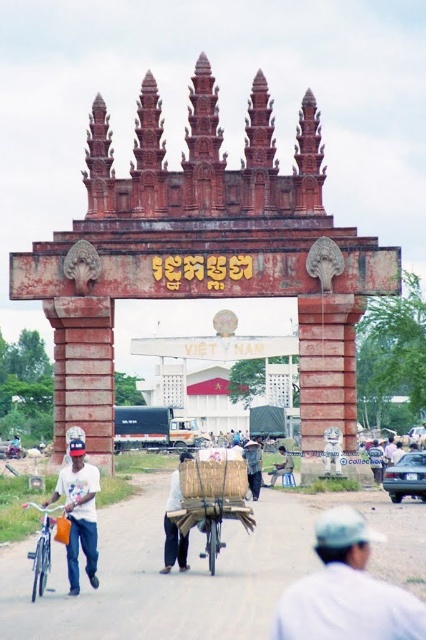
You are a traveler who just arrived at the archway and wants to take a photo with your bicycle and pants. You want to ensure that both the silver metallic bicycle at left and the blue denim pants at center are clearly visible in the photo. Given their sizes, which object should you position closer to the camera to make both appear balanced in size in the photo?

The silver metallic bicycle at left is larger in size than the blue denim pants at center. To balance their sizes in the photo, position the blue denim pants at center closer to the camera so that both objects appear similar in size.

You are a photographer planning to take a wide shot of the archway. You need to include both the silver metallic bicycle at left and the blue denim pants at center in the frame. Which object should you adjust to ensure both fit in the frame?

The silver metallic bicycle at left might be wider than blue denim pants at center, so you should adjust the position of the silver metallic bicycle at left to ensure both fit in the frame.